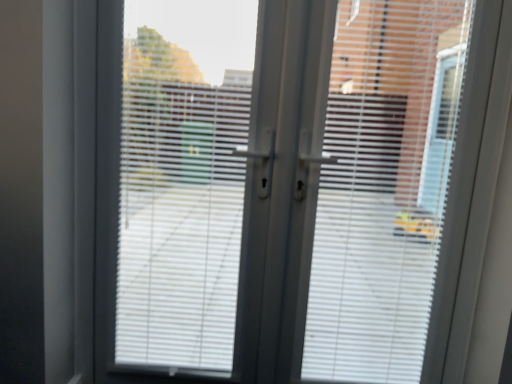
The width and height of the screenshot is (512, 384). What do you see at coordinates (182, 180) in the screenshot?
I see `white plastic window screen at center` at bounding box center [182, 180].

Locate an element on the screen. The image size is (512, 384). white plastic window screen at center is located at coordinates (182, 180).

What is the approximate width of white plastic window screen at center?

It is 1.00 inches.

What is the approximate width of white matte blinds at center?

The width of white matte blinds at center is 1.40 inches.

Where is `white matte blinds at center`? The width and height of the screenshot is (512, 384). white matte blinds at center is located at coordinates (383, 187).

The height and width of the screenshot is (384, 512). Describe the element at coordinates (383, 187) in the screenshot. I see `white matte blinds at center` at that location.

Locate an element on the screen. white plastic window screen at center is located at coordinates (182, 180).

Which object is positioned more to the left, white matte blinds at center or white plastic window screen at center?

Positioned to the left is white plastic window screen at center.

Is white matte blinds at center closer to camera compared to white plastic window screen at center?

Yes, it is in front of white plastic window screen at center.

Does point (416, 27) appear closer or farther from the camera than point (184, 70)?

Point (416, 27) appears to be closer to the viewer than point (184, 70).

From the image's perspective, is white matte blinds at center positioned above or below white plastic window screen at center?

white matte blinds at center is situated lower than white plastic window screen at center in the image.

From a real-world perspective, who is located lower, white matte blinds at center or white plastic window screen at center?

white plastic window screen at center, from a real-world perspective.

Considering the sizes of objects white matte blinds at center and white plastic window screen at center in the image provided, who is thinner, white matte blinds at center or white plastic window screen at center?

white plastic window screen at center.

Who is shorter, white matte blinds at center or white plastic window screen at center?

white plastic window screen at center is shorter.

Can you confirm if white matte blinds at center is bigger than white plastic window screen at center?

Indeed, white matte blinds at center has a larger size compared to white plastic window screen at center.

Would you say white matte blinds at center contains white plastic window screen at center?

No, white plastic window screen at center is not surrounded by white matte blinds at center.

Is white matte blinds at center not close to white plastic window screen at center?

No, white matte blinds at center is in close proximity to white plastic window screen at center.

Is white matte blinds at center turned away from white plastic window screen at center?

That's not correct — white matte blinds at center is not looking away from white plastic window screen at center.

How many degrees apart are the facing directions of white matte blinds at center and white plastic window screen at center?

The facing directions of white matte blinds at center and white plastic window screen at center are 0.00173 degrees apart.

Where is `blind in front of the white plastic window screen at center`? Image resolution: width=512 pixels, height=384 pixels. blind in front of the white plastic window screen at center is located at coordinates (383, 187).

Which is more to the right, white plastic window screen at center or white matte blinds at center?

From the viewer's perspective, white matte blinds at center appears more on the right side.

Which is behind, white plastic window screen at center or white matte blinds at center?

white plastic window screen at center is more distant.

Considering the positions of points (153, 93) and (398, 49), is point (153, 93) closer to camera compared to point (398, 49)?

No, it is behind (398, 49).

From the image's perspective, is white plastic window screen at center located beneath white matte blinds at center?

No.

From a real-world perspective, which object stands above the other?

In real-world perspective, white matte blinds at center is above.

Which object is thinner, white plastic window screen at center or white matte blinds at center?

With smaller width is white plastic window screen at center.

Considering the sizes of objects white plastic window screen at center and white matte blinds at center in the image provided, who is shorter, white plastic window screen at center or white matte blinds at center?

white plastic window screen at center.

From the picture: Is white plastic window screen at center bigger or smaller than white matte blinds at center?

Considering their sizes, white plastic window screen at center takes up less space than white matte blinds at center.

Would you say white plastic window screen at center is inside or outside white matte blinds at center?

white plastic window screen at center is located beyond the bounds of white matte blinds at center.

Consider the image. Is white plastic window screen at center far from white matte blinds at center?

No, white plastic window screen at center is not far away from white matte blinds at center.

Is white plastic window screen at center looking in the opposite direction of white matte blinds at center?

No, white plastic window screen at center's orientation is not away from white matte blinds at center.

How distant is white plastic window screen at center from white matte blinds at center?

A distance of 19.38 inches exists between white plastic window screen at center and white matte blinds at center.

This screenshot has height=384, width=512. Identify the location of window screen to the left of white matte blinds at center. (182, 180).

Identify the location of window screen that appears above the white matte blinds at center (from the image's perspective). (182, 180).

Where is `blind that is in front of the white plastic window screen at center`? This screenshot has height=384, width=512. blind that is in front of the white plastic window screen at center is located at coordinates (383, 187).